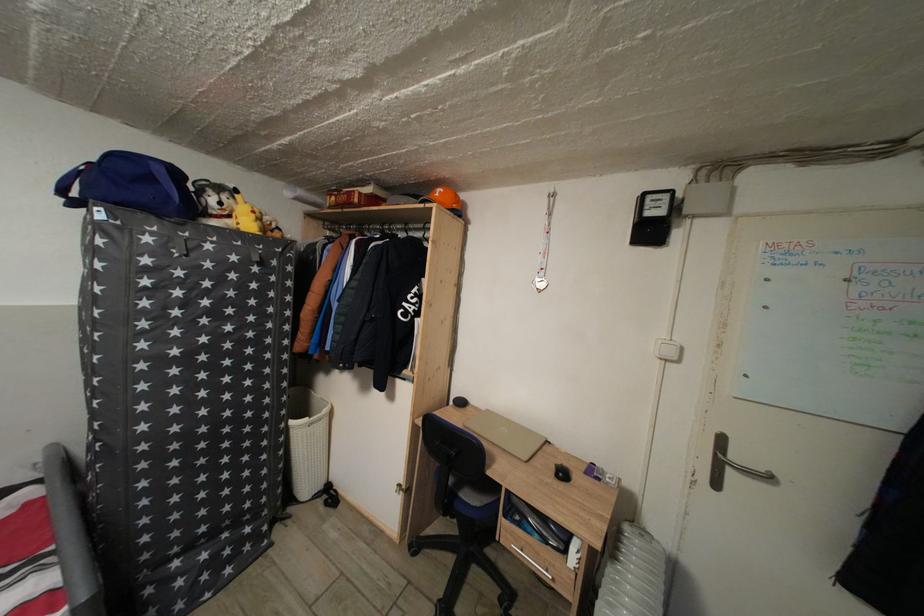
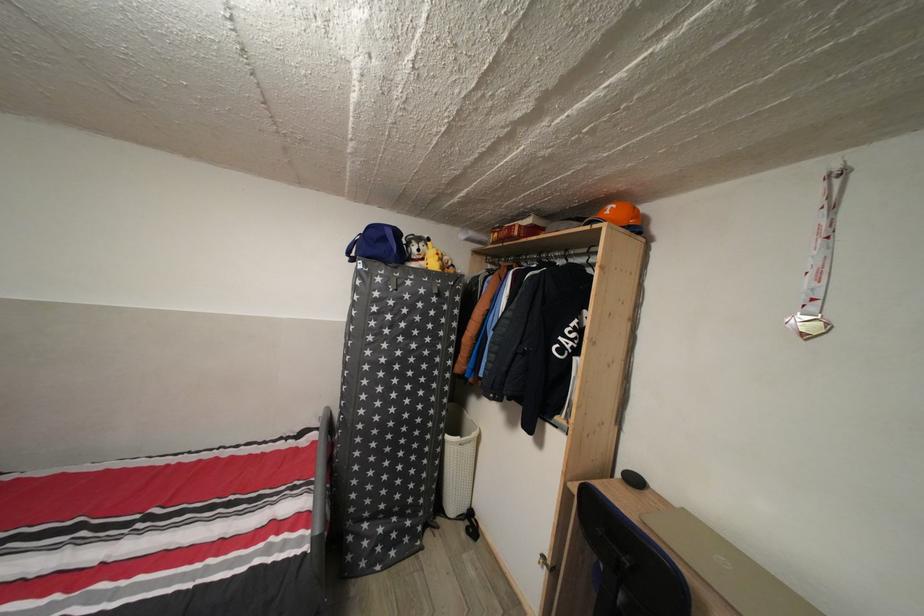
In the second image, find the point that corresponds to point (298, 429) in the first image.

(455, 444)